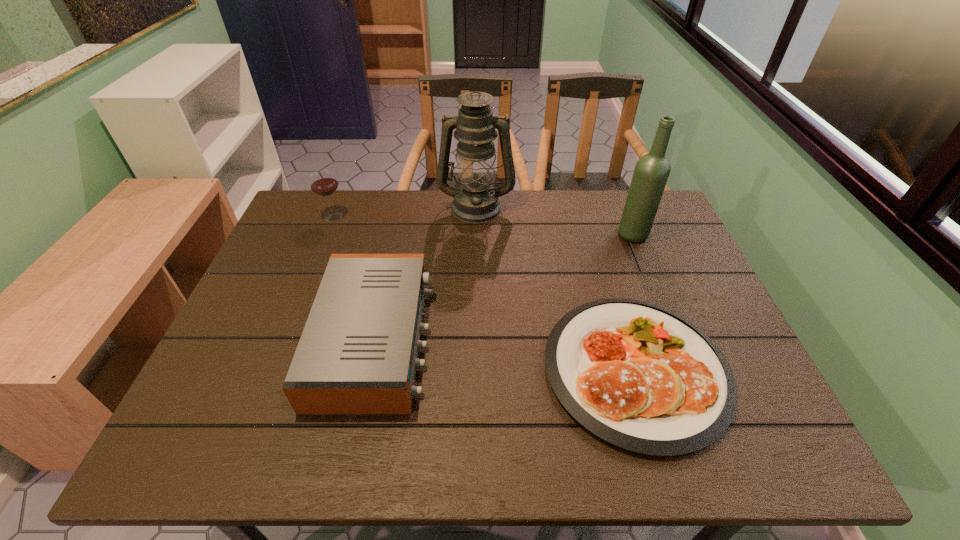
Identify the location of oil lamp. This screenshot has width=960, height=540. (475, 201).

Find the location of a particular element. The image size is (960, 540). wine bottle is located at coordinates (652, 170).

Locate an element on the screen. the third shortest object is located at coordinates (323, 182).

Find the location of a particular element. wineglass is located at coordinates (323, 182).

You are a GUI agent. You are given a task and a screenshot of the screen. Output one action in this format:
    pyautogui.click(x=<x>, y=<y>)
    Task: Click on the radio receiver
    The width and height of the screenshot is (960, 540).
    Given the screenshot: What is the action you would take?
    pyautogui.click(x=358, y=353)

Find the location of a particular element. the shortest object is located at coordinates (637, 375).

Image resolution: width=960 pixels, height=540 pixels. Identify the location of vacant point located 0.110m on the left of the oil lamp. (405, 207).

In order to click on free spot located on the front of the wine bottle in this screenshot , I will do `click(655, 288)`.

Identify the location of free spot located on the back of the wineglass. The height and width of the screenshot is (540, 960). (341, 198).

Where is `free spot located 0.260m on the control panel of the second shortest object`? This screenshot has height=540, width=960. free spot located 0.260m on the control panel of the second shortest object is located at coordinates (539, 339).